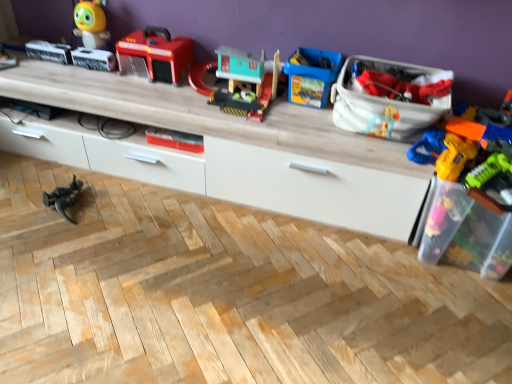
The width and height of the screenshot is (512, 384). Identify the location of vacant area on top of blue plastic toy at center, marked as the 6th toy in a left-to-right arrangement (from a real-world perspective). pos(322,56).